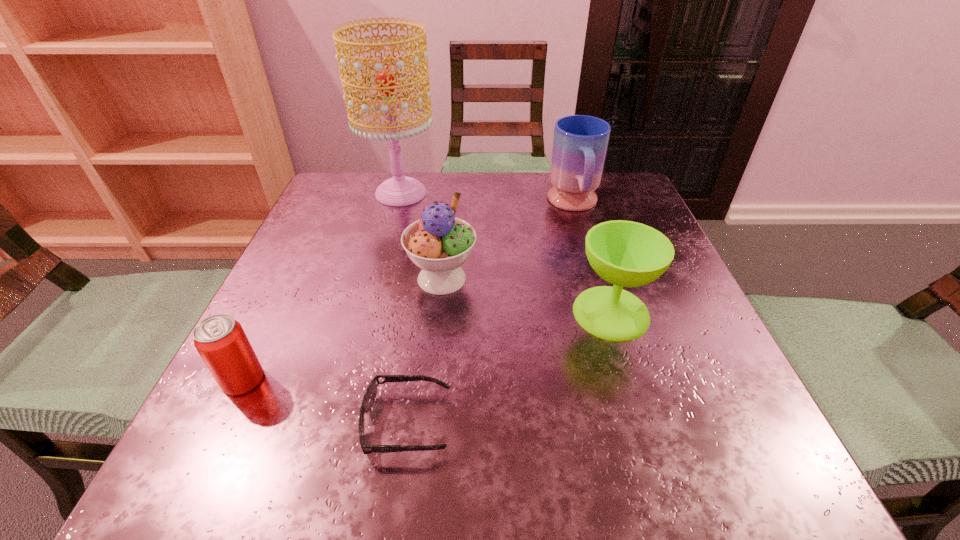
Find the location of a particular element. This screenshot has height=540, width=960. the tallest object is located at coordinates tap(400, 190).

Locate an element on the screen. This screenshot has height=540, width=960. mug is located at coordinates (580, 142).

At what (x,y) coordinates should I click in order to perform the action: click on icecream. Please return your answer as a coordinate pair (x, y). This screenshot has width=960, height=540. Looking at the image, I should click on (439, 243).

Locate an element on the screen. The width and height of the screenshot is (960, 540). wineglass is located at coordinates tap(624, 253).

This screenshot has width=960, height=540. In order to click on the leftmost object in this screenshot , I will do `click(220, 340)`.

At what (x,y) coordinates should I click in order to perform the action: click on the fifth tallest object. Please return your answer as a coordinate pair (x, y). The image size is (960, 540). Looking at the image, I should click on (220, 340).

At what (x,y) coordinates should I click in order to perform the action: click on the shortest object. Please return your answer as a coordinate pair (x, y). Image resolution: width=960 pixels, height=540 pixels. Looking at the image, I should click on (370, 395).

The image size is (960, 540). Find the location of `free space located on the front of the tallest object`. free space located on the front of the tallest object is located at coordinates (385, 253).

You are a GUI agent. You are given a task and a screenshot of the screen. Output one action in this format:
    pyautogui.click(x=<x>, y=<y>)
    Task: Click on the vacant space located on the side of the mug with the handle
    The height and width of the screenshot is (540, 960).
    Given the screenshot: What is the action you would take?
    pyautogui.click(x=606, y=310)

Identify the location of vacant space located 0.150m on the back of the icecream. [448, 215].